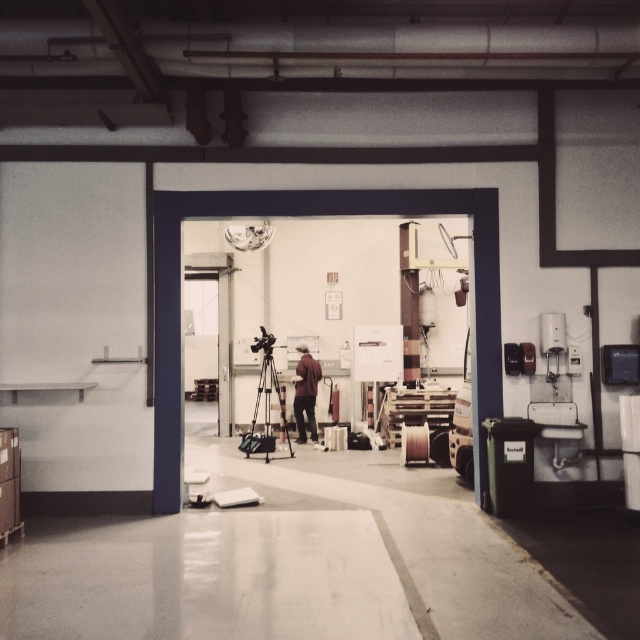
Who is more distant from viewer, (262, 392) or (300, 392)?

The point (262, 392) is behind.

Who is more forward, [262,388] or [307,413]?

Positioned in front is point [307,413].

Which is behind, point (264, 438) or point (314, 396)?

Point (314, 396)

The width and height of the screenshot is (640, 640). Identify the location of matte black tripod at center. (266, 404).